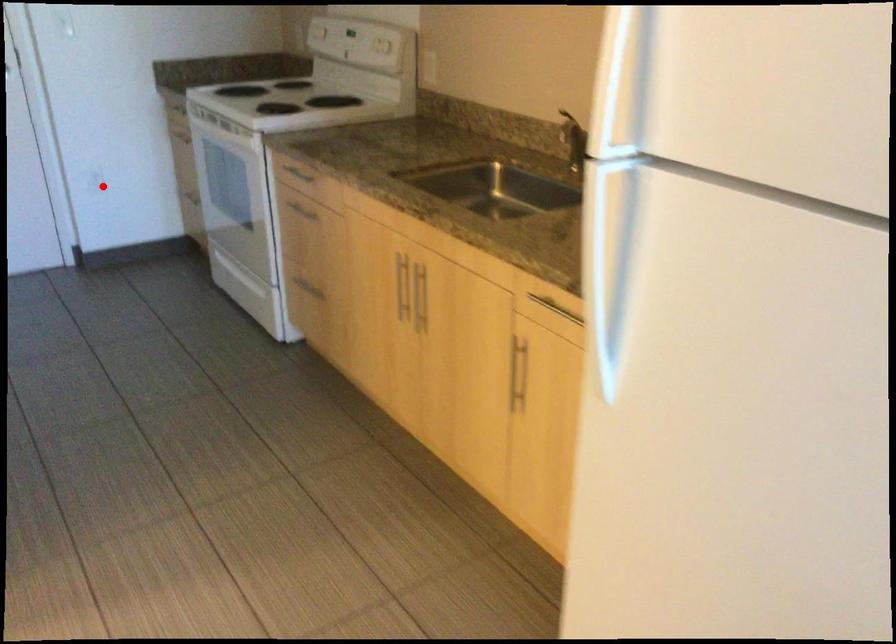
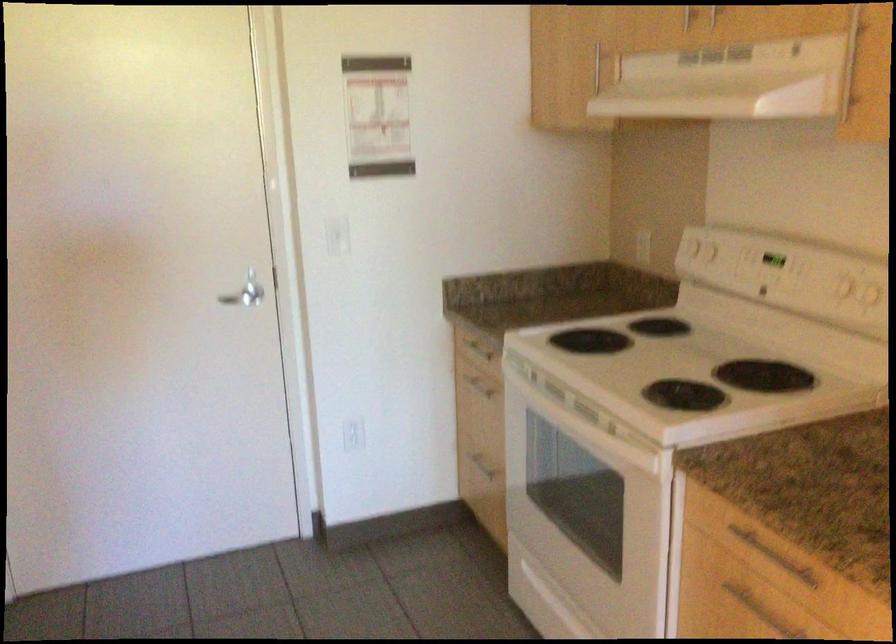
Where in the second image is the point corresponding to the highlighted location from the first image?

(352, 433)